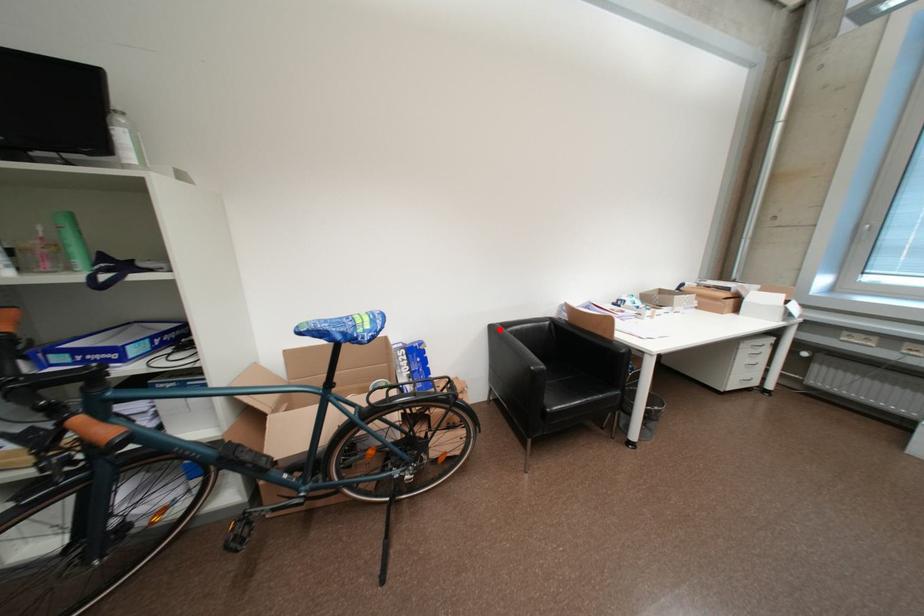
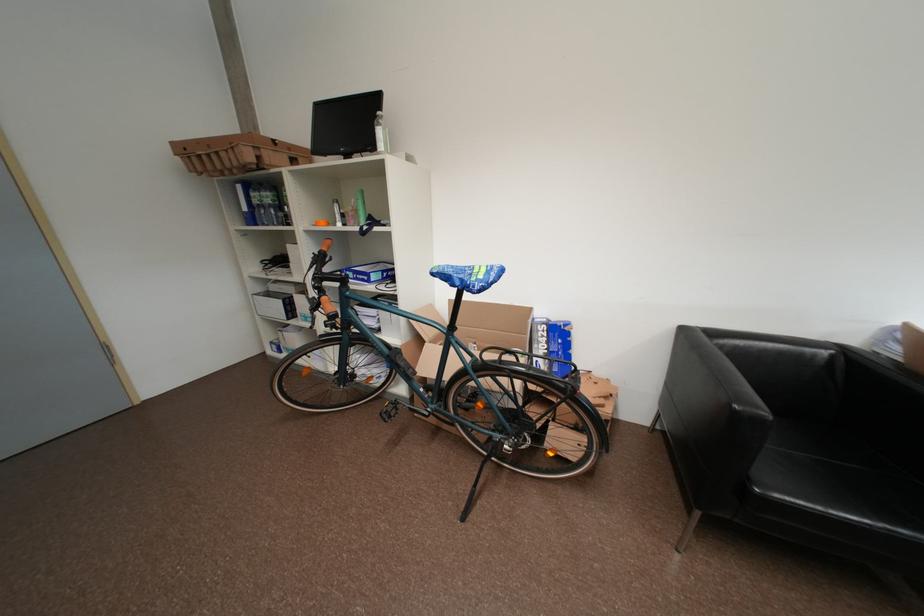
Question: I am providing you with two images of the same scene from different viewpoints. A red point is marked on the first image. Can you still see the location of the red point in image 2?

Choices:
 (A) Yes
 (B) No

Answer: (A)